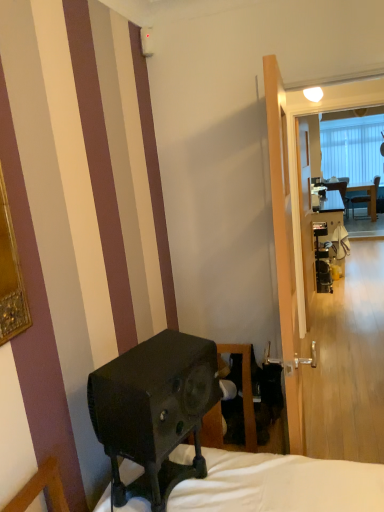
The height and width of the screenshot is (512, 384). Describe the element at coordinates (330, 240) in the screenshot. I see `matte black desk at center` at that location.

At what (x,y) coordinates should I click in order to perform the action: click on matte black desk at center. Please return your answer as a coordinate pair (x, y). The image size is (384, 512). Looking at the image, I should click on (330, 240).

Image resolution: width=384 pixels, height=512 pixels. What do you see at coordinates (284, 250) in the screenshot?
I see `transparent glass screen door at center, the second screen door in the right-to-left sequence` at bounding box center [284, 250].

In order to face black matte speaker at lower left, should I rotate leftwards or rightwards?

To face it directly, rotate left by 2.719 degrees.

The height and width of the screenshot is (512, 384). What are the coordinates of `clear glass screen door at center, which appears as the first screen door when viewed from the back` in the screenshot? It's located at (305, 213).

Considering the points (169, 440) and (294, 406), which point is behind, point (169, 440) or point (294, 406)?

The point (294, 406) is more distant.

Is black matte speaker at lower left aimed at transparent glass screen door at center, which is the first screen door from front to back?

No.

Is black matte speaker at lower left shorter than transparent glass screen door at center, which is counted as the first screen door, starting from the left?

Correct, black matte speaker at lower left is not as tall as transparent glass screen door at center, which is counted as the first screen door, starting from the left.

Which of these two, transparent glass screen door at center, positioned as the second screen door in back-to-front order, or clear glass screen door at center, which ranks as the 2th screen door in left-to-right order, is bigger?

With larger size is transparent glass screen door at center, positioned as the second screen door in back-to-front order.

Is transparent glass screen door at center, positioned as the second screen door in back-to-front order, directly adjacent to clear glass screen door at center, acting as the 1th screen door starting from the right?

There is a gap between transparent glass screen door at center, positioned as the second screen door in back-to-front order, and clear glass screen door at center, acting as the 1th screen door starting from the right.

Considering the points (299, 401) and (305, 160), which point is in front, point (299, 401) or point (305, 160)?

The point (299, 401) is more forward.

Is transparent glass screen door at center, positioned as the second screen door in back-to-front order, to the right of clear glass screen door at center, acting as the 1th screen door starting from the right, from the viewer's perspective?

Incorrect, transparent glass screen door at center, positioned as the second screen door in back-to-front order, is not on the right side of clear glass screen door at center, acting as the 1th screen door starting from the right.

Relative to transparent glass screen door at center, which is the first screen door from front to back, is matte black desk at center in front or behind?

matte black desk at center is positioned farther from the viewer than transparent glass screen door at center, which is the first screen door from front to back.

Is matte black desk at center facing towards transparent glass screen door at center, the second screen door in the right-to-left sequence?

No, matte black desk at center is not aimed at transparent glass screen door at center, the second screen door in the right-to-left sequence.

Considering the sizes of matte black desk at center and transparent glass screen door at center, which is counted as the first screen door, starting from the left, in the image, is matte black desk at center wider or thinner than transparent glass screen door at center, which is counted as the first screen door, starting from the left,?

matte black desk at center is wider than transparent glass screen door at center, which is counted as the first screen door, starting from the left.

In terms of width, does transparent glass screen door at center, which is the first screen door from front to back, look wider or thinner when compared to matte black desk at center?

Clearly, transparent glass screen door at center, which is the first screen door from front to back, has less width compared to matte black desk at center.

Considering the relative sizes of transparent glass screen door at center, which is the first screen door from front to back, and matte black desk at center in the image provided, is transparent glass screen door at center, which is the first screen door from front to back, smaller than matte black desk at center?

Yes.

Is point (312, 274) closer or farther from the camera than point (322, 242)?

Clearly, point (312, 274) is closer to the camera than point (322, 242).

Can matte black desk at center be found inside black matte speaker at lower left?

No, black matte speaker at lower left does not contain matte black desk at center.

Considering the sizes of black matte speaker at lower left and matte black desk at center in the image, is black matte speaker at lower left wider or thinner than matte black desk at center?

In the image, black matte speaker at lower left appears to be more narrow than matte black desk at center.

How many degrees apart are the facing directions of black matte speaker at lower left and matte black desk at center?

17.4 degrees separate the facing orientations of black matte speaker at lower left and matte black desk at center.

Is black matte speaker at lower left oriented towards matte black desk at center?

No.

Which object is positioned more to the left, clear glass screen door at center, which ranks as the 2th screen door in left-to-right order, or transparent glass screen door at center, positioned as the second screen door in back-to-front order?

transparent glass screen door at center, positioned as the second screen door in back-to-front order, is more to the left.

Is point (302, 124) positioned in front of point (271, 162)?

No, (302, 124) is behind (271, 162).

From a real-world perspective, is clear glass screen door at center, acting as the 1th screen door starting from the right, located higher than transparent glass screen door at center, positioned as the second screen door in back-to-front order?

No, from a real-world perspective, clear glass screen door at center, acting as the 1th screen door starting from the right, is not over transparent glass screen door at center, positioned as the second screen door in back-to-front order

Is clear glass screen door at center, acting as the 1th screen door starting from the right, positioned beyond the bounds of transparent glass screen door at center, which is the first screen door from front to back?

Yes, clear glass screen door at center, acting as the 1th screen door starting from the right, is located beyond the bounds of transparent glass screen door at center, which is the first screen door from front to back.

In the scene shown: Can you confirm if black matte speaker at lower left is taller than clear glass screen door at center, acting as the 1th screen door starting from the right?

No.

Based on the photo, what's the angular difference between black matte speaker at lower left and clear glass screen door at center, acting as the 1th screen door starting from the right,'s facing directions?

12.5 degrees.

Which is closer to the camera, (153, 450) or (308, 207)?

Clearly, point (153, 450) is closer to the camera than point (308, 207).

Find the location of a particular element. This screenshot has height=512, width=384. loudspeaker that is in front of the transparent glass screen door at center, positioned as the second screen door in back-to-front order is located at coordinates (154, 411).

The image size is (384, 512). I want to click on screen door that appears below the transparent glass screen door at center, which is the first screen door from front to back (from a real-world perspective), so click(305, 213).

Looking at the image, which one is located further to clear glass screen door at center, positioned as the 2th screen door in front-to-back order, transparent glass screen door at center, positioned as the second screen door in back-to-front order, or black matte speaker at lower left?

Among the two, black matte speaker at lower left is located further to clear glass screen door at center, positioned as the 2th screen door in front-to-back order.

Looking at this image, from the image, which object appears to be farther from transparent glass screen door at center, positioned as the second screen door in back-to-front order, matte black desk at center or black matte speaker at lower left?

The object further to transparent glass screen door at center, positioned as the second screen door in back-to-front order, is matte black desk at center.

Estimate the real-world distances between objects in this image. Which object is further from clear glass screen door at center, positioned as the 2th screen door in front-to-back order, black matte speaker at lower left or transparent glass screen door at center, the second screen door in the right-to-left sequence?

black matte speaker at lower left.

When comparing their distances from black matte speaker at lower left, does transparent glass screen door at center, which is the first screen door from front to back, or matte black desk at center seem closer?

transparent glass screen door at center, which is the first screen door from front to back.

Estimate the real-world distances between objects in this image. Which object is closer to matte black desk at center, clear glass screen door at center, which ranks as the 2th screen door in left-to-right order, or transparent glass screen door at center, which is the first screen door from front to back?

clear glass screen door at center, which ranks as the 2th screen door in left-to-right order.

When comparing their distances from matte black desk at center, does black matte speaker at lower left or clear glass screen door at center, acting as the 1th screen door starting from the right, seem further?

Based on the image, black matte speaker at lower left appears to be further to matte black desk at center.

Which object lies further to the anchor point clear glass screen door at center, which appears as the first screen door when viewed from the back, transparent glass screen door at center, which is the first screen door from front to back, or matte black desk at center?

Among the two, transparent glass screen door at center, which is the first screen door from front to back, is located further to clear glass screen door at center, which appears as the first screen door when viewed from the back.

Based on the photo, considering their positions, is black matte speaker at lower left positioned further to clear glass screen door at center, positioned as the 2th screen door in front-to-back order, than matte black desk at center?

black matte speaker at lower left is further to clear glass screen door at center, positioned as the 2th screen door in front-to-back order.

At what (x,y) coordinates should I click in order to perform the action: click on screen door between black matte speaker at lower left and clear glass screen door at center, positioned as the 2th screen door in front-to-back order, from front to back. Please return your answer as a coordinate pair (x, y). The width and height of the screenshot is (384, 512). Looking at the image, I should click on (284, 250).

Where is `screen door between transparent glass screen door at center, which is counted as the first screen door, starting from the left, and matte black desk at center, along the z-axis`? The height and width of the screenshot is (512, 384). screen door between transparent glass screen door at center, which is counted as the first screen door, starting from the left, and matte black desk at center, along the z-axis is located at coordinates (305, 213).